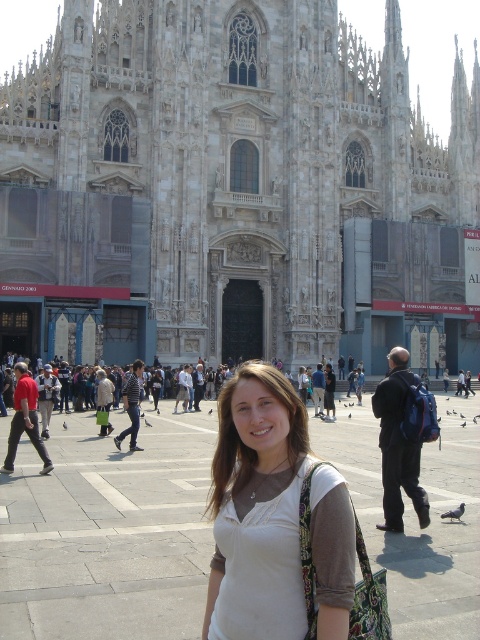
Where is `gray stone church at center`? The height and width of the screenshot is (640, 480). gray stone church at center is located at coordinates (235, 189).

Between gray stone church at center and white fabric shirt at center, which one appears on the left side from the viewer's perspective?

white fabric shirt at center is more to the left.

Between point (233, 260) and point (271, 579), which one is positioned behind?

Positioned behind is point (233, 260).

The image size is (480, 640). Identify the location of gray stone church at center. (235, 189).